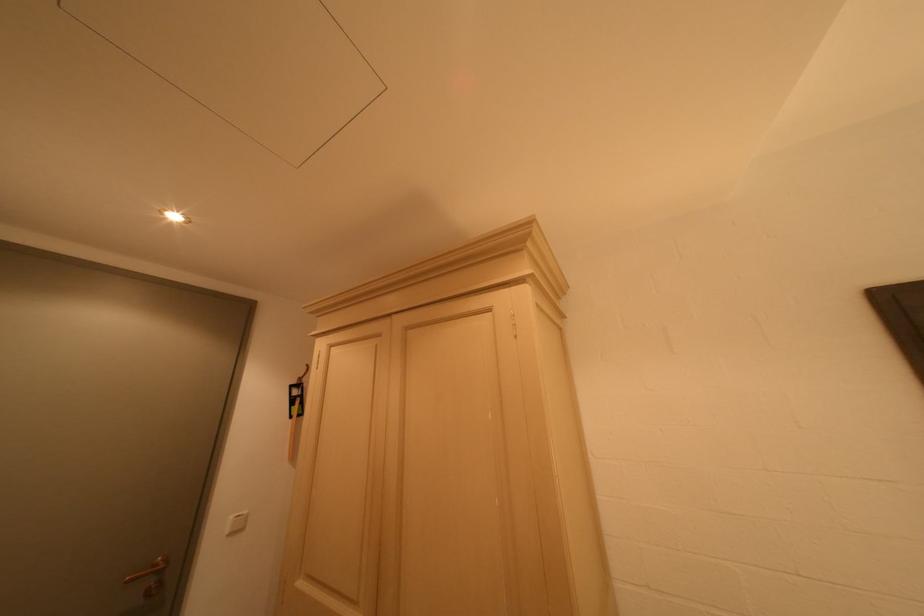
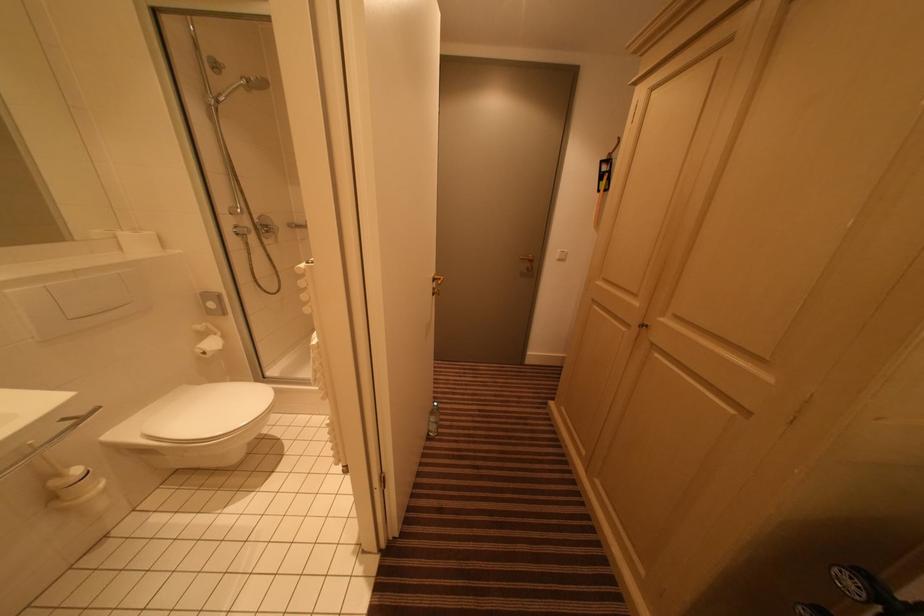
Based on the continuous images, in which direction is the camera rotating?

The camera's rotation is toward left-down.